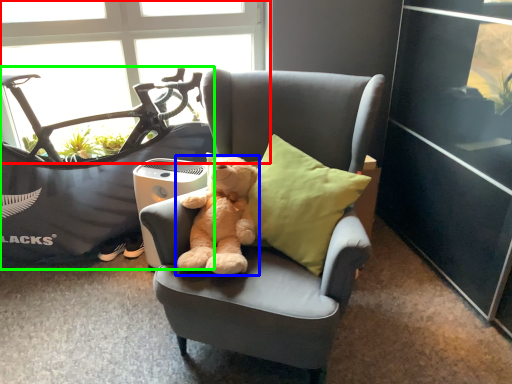
Question: Estimate the real-world distances between objects in this image. Which object is farther from window (highlighted by a red box), teddy bear (highlighted by a blue box) or mountain bike (highlighted by a green box)?

Choices:
 (A) teddy bear
 (B) mountain bike

Answer: (A)